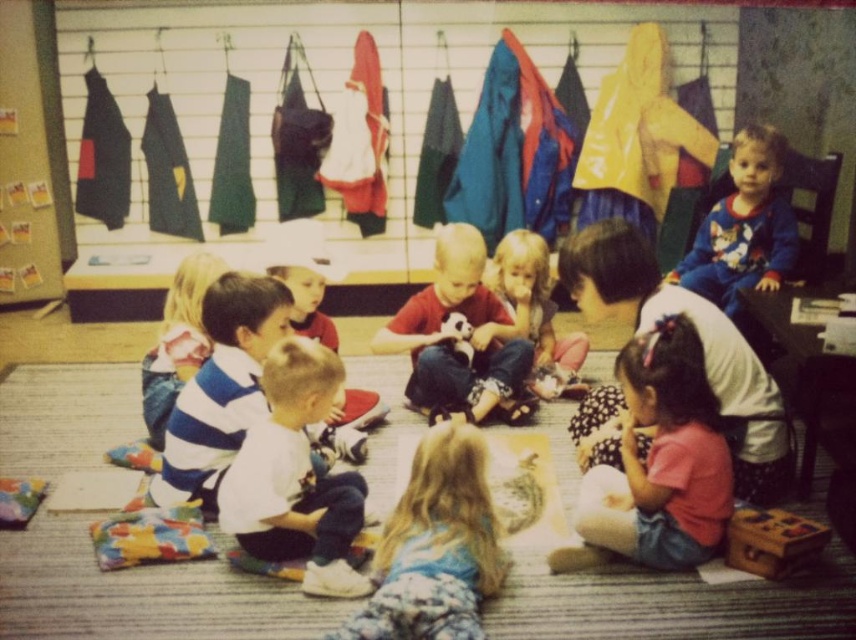
You are a teacher in a classroom and want to locate the white cotton shirt at center. Where would you find it in relation to the grid wall?

The white cotton shirt at center is located at the 2D coordinates point (295,476) on the grid wall.

You are a teacher in the classroom. You need to hang two shirts on the wall hooks. The matte red shirt at center and the striped fabric shirt at center are both on the floor. Which shirt should you pick up first if you want to hang the taller one higher on the hook?

The matte red shirt at center is taller than the striped fabric shirt at center, so you should pick up the matte red shirt at center first to hang it higher on the hook.

You are a teacher in a classroom and notice two items in the scene. One is the printed cotton pajamas at upper right and the other is the light brown hair at center. Which item is located more to the right side of the classroom?

The printed cotton pajamas at upper right is positioned on the right side of light brown hair at center, so it is more to the right.